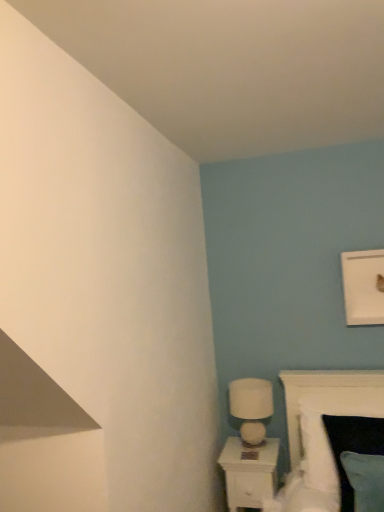
Question: Considering the positions of point (350, 393) and point (235, 399), is point (350, 393) closer or farther from the camera than point (235, 399)?

Choices:
 (A) closer
 (B) farther

Answer: (A)

Question: Would you say white soft bed at lower right is inside or outside white glossy table lamp at lower right?

Choices:
 (A) outside
 (B) inside

Answer: (A)

Question: Which of these objects is positioned closest to the white glossy table lamp at lower right?

Choices:
 (A) white glossy nightstand at lower right
 (B) white soft bed at lower right

Answer: (A)

Question: Estimate the real-world distances between objects in this image. Which object is farther from the white glossy table lamp at lower right?

Choices:
 (A) white soft bed at lower right
 (B) white glossy nightstand at lower right

Answer: (A)